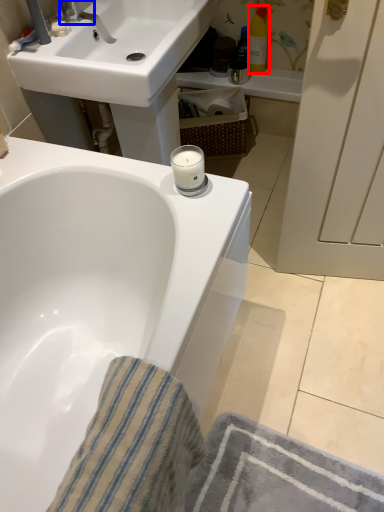
Question: Among these objects, which one is nearest to the camera, toiletry (highlighted by a red box) or plumbing fixture (highlighted by a blue box)?

Choices:
 (A) toiletry
 (B) plumbing fixture

Answer: (B)